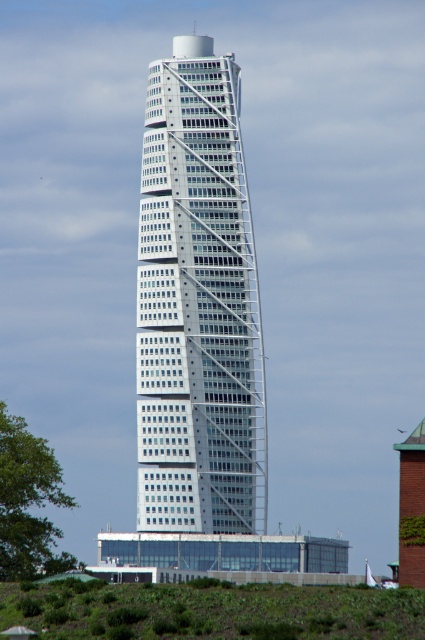
Does white glass building at center have a lesser height compared to green grass at lower left?

In fact, white glass building at center may be taller than green grass at lower left.

What are the coordinates of `white glass building at center` in the screenshot? It's located at (198, 305).

The height and width of the screenshot is (640, 425). I want to click on white glass building at center, so click(x=198, y=305).